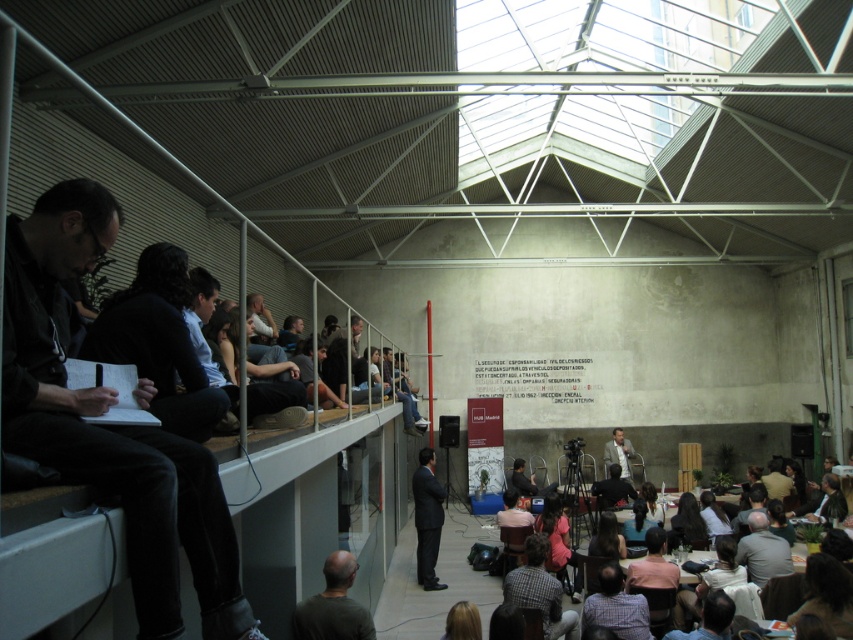
Question: Which object is positioned closest to the dark brown fabric chairs at lower center?

Choices:
 (A) dark green shirt at lower center
 (B) plaid shirt at lower center

Answer: (B)

Question: Can you confirm if dark brown fabric chairs at lower center is bigger than dark green shirt at lower center?

Choices:
 (A) no
 (B) yes

Answer: (B)

Question: Which point is farther to the camera?

Choices:
 (A) (840, 538)
 (B) (316, 618)

Answer: (A)

Question: Does dark brown fabric chairs at lower center lie behind plaid shirt at lower center?

Choices:
 (A) yes
 (B) no

Answer: (A)

Question: Can you confirm if dark green shirt at lower center is thinner than plaid shirt at lower center?

Choices:
 (A) yes
 (B) no

Answer: (A)

Question: Considering the real-world distances, which object is farthest from the dark brown fabric chairs at lower center?

Choices:
 (A) dark suit at center
 (B) checkered shirt at lower center

Answer: (A)